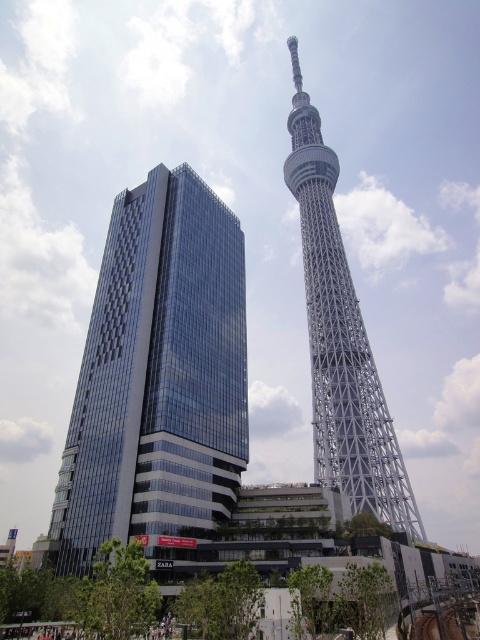
Is white lattice tower at center bigger than metallic gray train track at lower right?

Yes, white lattice tower at center is bigger than metallic gray train track at lower right.

Is white lattice tower at center positioned behind metallic gray train track at lower right?

Yes, it is.

Is point (379, 410) farther from camera compared to point (417, 636)?

That is True.

You are a GUI agent. You are given a task and a screenshot of the screen. Output one action in this format:
    pyautogui.click(x=<x>, y=<y>)
    Task: Click on the white lattice tower at center
    The image size is (480, 640).
    Given the screenshot: What is the action you would take?
    pyautogui.click(x=340, y=340)

Can you confirm if glassy modern building at center is smaller than metallic gray train track at lower right?

Incorrect, glassy modern building at center is not smaller in size than metallic gray train track at lower right.

Does glassy modern building at center have a lesser width compared to metallic gray train track at lower right?

Incorrect, glassy modern building at center's width is not less than metallic gray train track at lower right's.

This screenshot has width=480, height=640. I want to click on glassy modern building at center, so click(x=158, y=380).

Where is `glassy modern building at center`? glassy modern building at center is located at coordinates (158, 380).

Which of these two, glassy modern building at center or white lattice tower at center, stands taller?

white lattice tower at center is taller.

Can you confirm if glassy modern building at center is positioned above white lattice tower at center?

Actually, glassy modern building at center is below white lattice tower at center.

Which is in front, point (97, 356) or point (308, 241)?

Point (97, 356)

Where is `glassy modern building at center`? Image resolution: width=480 pixels, height=640 pixels. glassy modern building at center is located at coordinates (158, 380).